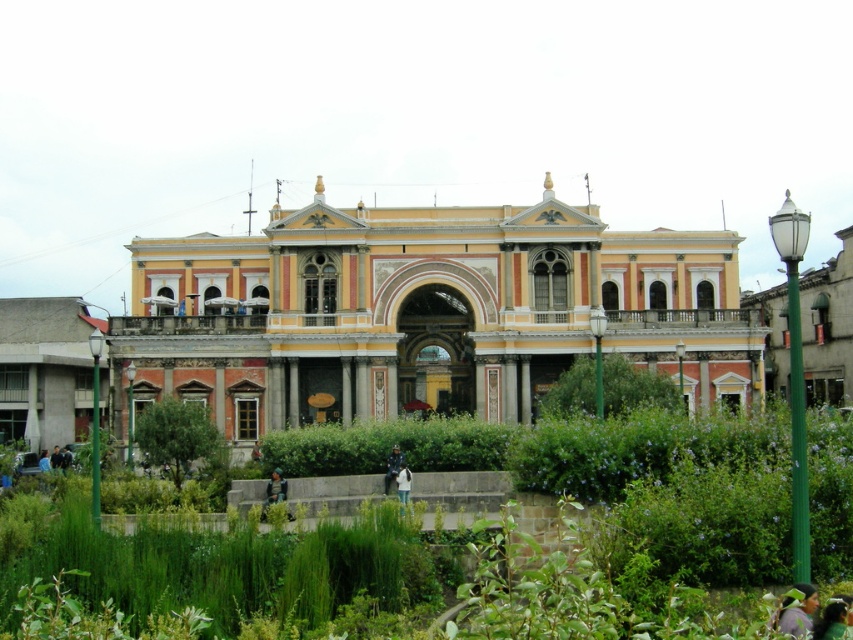
Question: Can you confirm if green leafy bush at center is bigger than camouflage fabric jacket at lower center?

Choices:
 (A) no
 (B) yes

Answer: (B)

Question: Which object appears closest to the camera in this image?

Choices:
 (A) blue denim jacket at lower left
 (B) green leafy bush at center

Answer: (B)

Question: Which of the following is the closest to the observer?

Choices:
 (A) (251, 451)
 (B) (704, 570)

Answer: (B)

Question: Is green leafy bush at lower left positioned at the back of green fabric bag at center?

Choices:
 (A) yes
 (B) no

Answer: (B)

Question: Which of these objects is positioned closest to the dark green fabric jacket at lower left?

Choices:
 (A) green fabric jacket at center
 (B) green leafy bush at lower left
 (C) white cotton shirt at lower center

Answer: (B)

Question: In this image, where is camouflage fabric jacket at lower center located relative to green fabric jacket at center?

Choices:
 (A) right
 (B) left

Answer: (B)